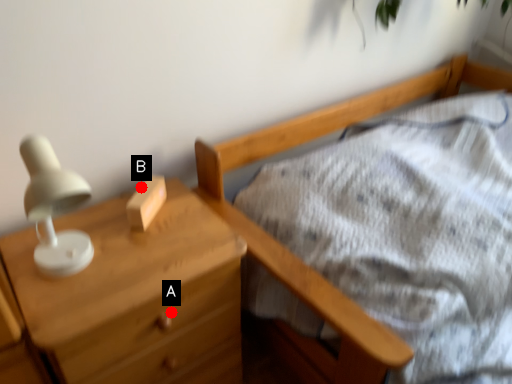
Question: Two points are circled on the image, labeled by A and B beside each circle. Which point is closer to the camera taking this photo?

Choices:
 (A) A is closer
 (B) B is closer

Answer: (A)